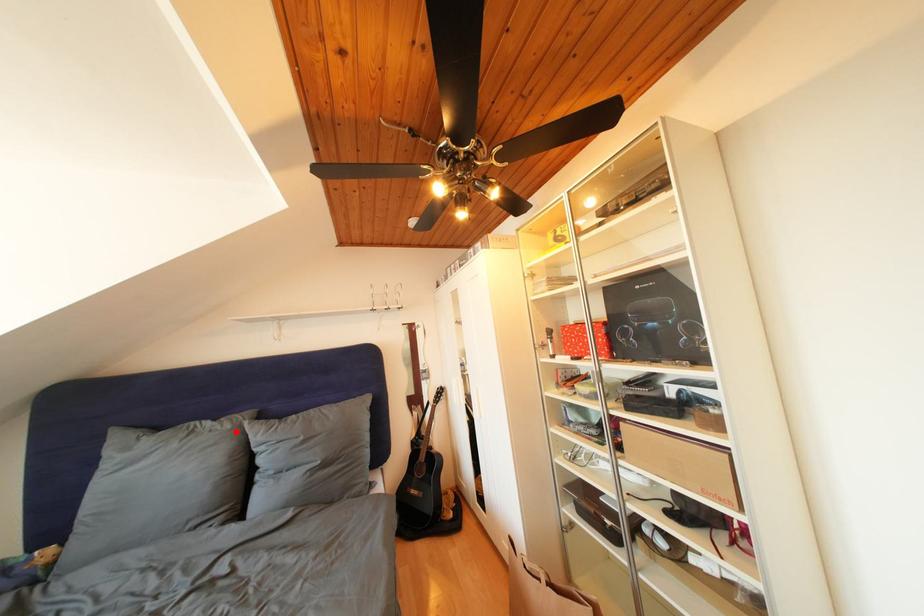
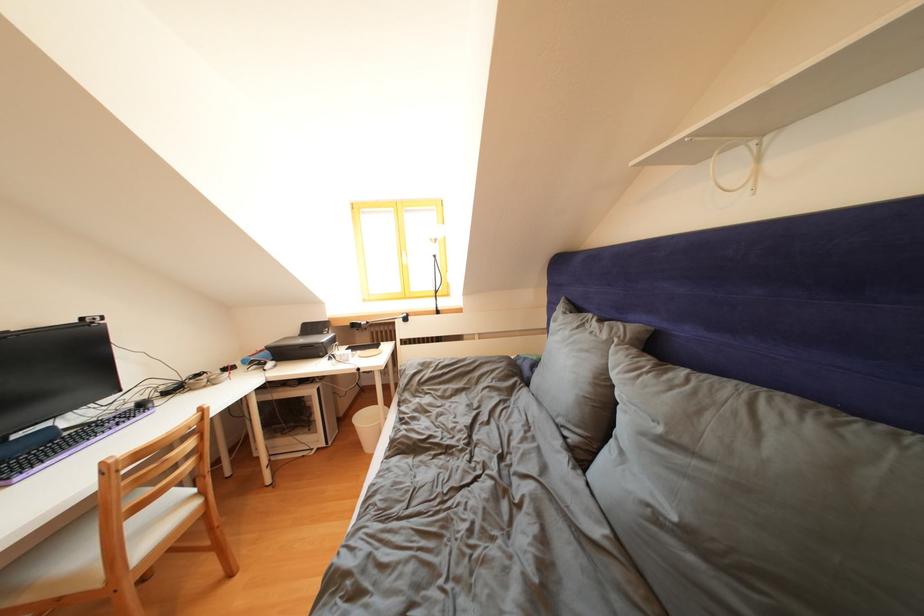
Where in the second image is the point corresponding to the highlighted location from the first image?

(612, 341)